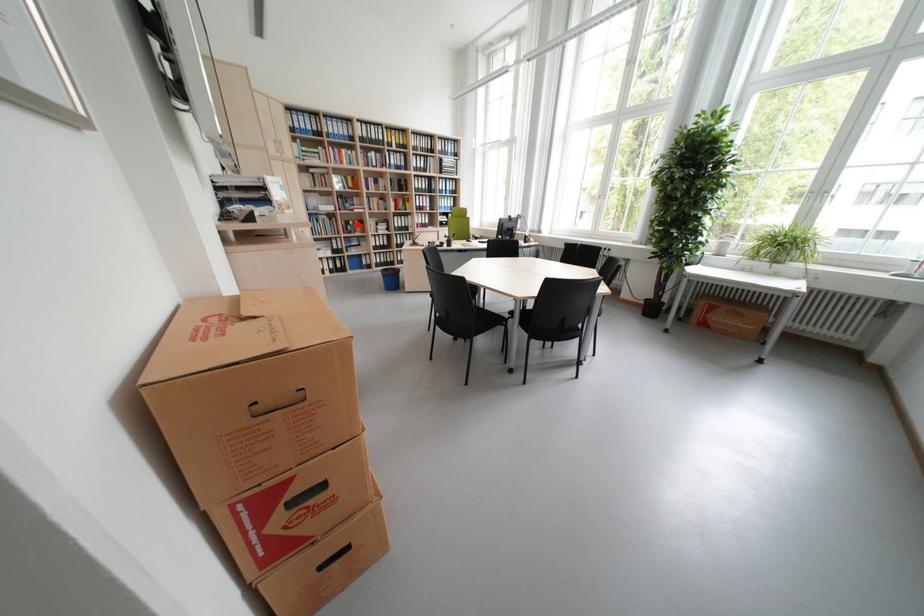
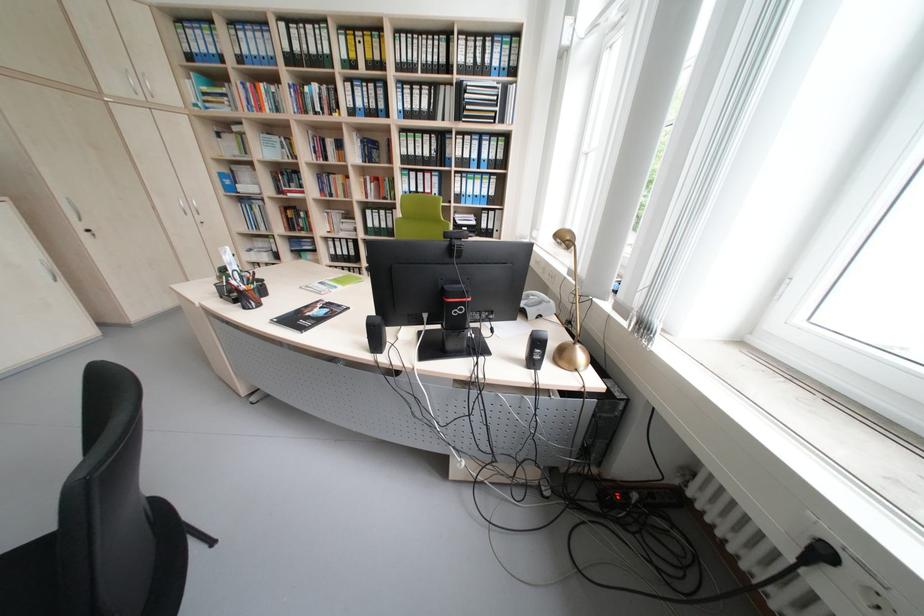
Question: I am providing you with two images of the same scene from different viewpoints. A red point is shown in image1. For the corresponding object point in image2, is it positioned nearer or farther from the camera?

Choices:
 (A) Nearer
 (B) Farther

Answer: (B)